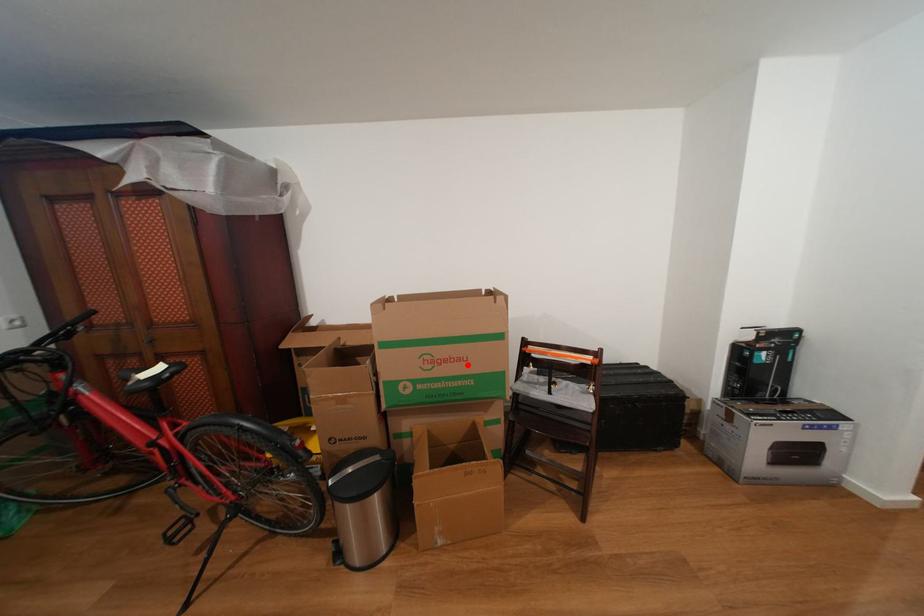
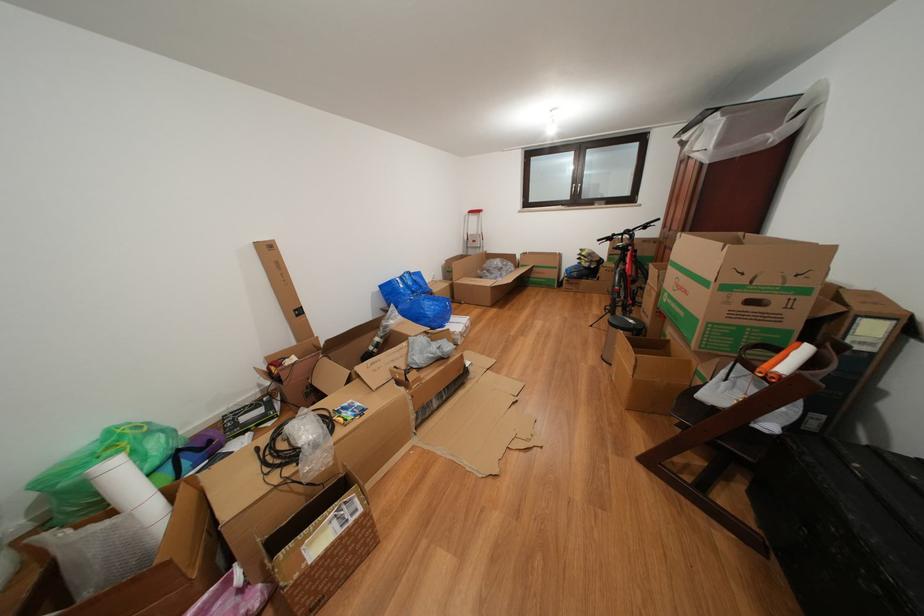
Question: I am providing you with two images of the same scene from different viewpoints. Image1 has a red point marked. In image2, the corresponding 3D location appears at what relative position? Reply with the corresponding letter.

Choices:
 (A) Closer
 (B) Farther

Answer: (A)